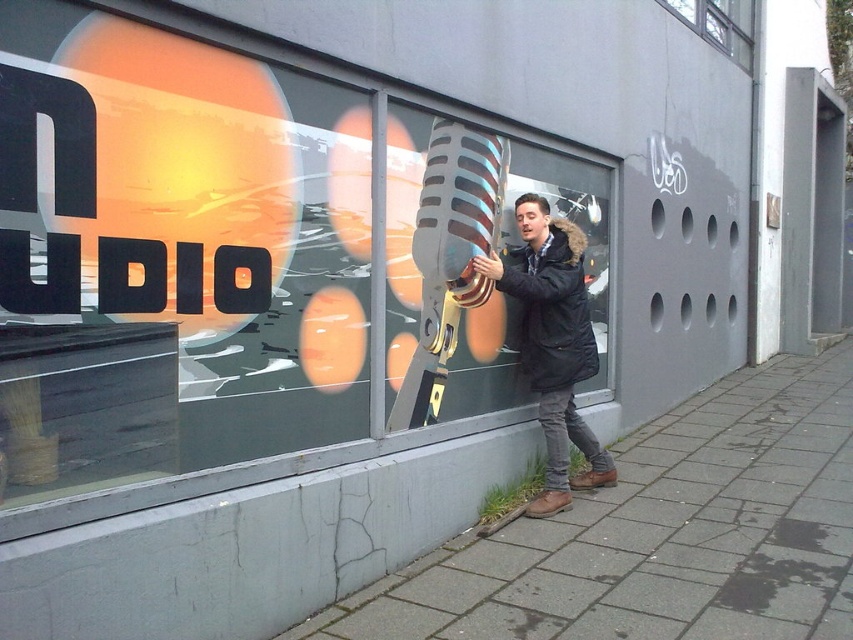
Looking at this image, which of these two, metallic glass microphone at center or gray concrete pavement at lower right, stands taller?

metallic glass microphone at center is taller.

What are the coordinates of `metallic glass microphone at center` in the screenshot? It's located at (210, 264).

Describe the element at coordinates (210, 264) in the screenshot. Image resolution: width=853 pixels, height=640 pixels. I see `metallic glass microphone at center` at that location.

Where is `metallic glass microphone at center`? The width and height of the screenshot is (853, 640). metallic glass microphone at center is located at coordinates (210, 264).

Consider the image. Who is positioned more to the left, gray concrete pavement at lower right or clear glass window at upper center?

Positioned to the left is gray concrete pavement at lower right.

Does point (734, 605) come closer to viewer compared to point (724, 44)?

Yes.

Locate an element on the screen. This screenshot has width=853, height=640. gray concrete pavement at lower right is located at coordinates (660, 532).

Based on the photo, measure the distance between black matte jacket at center and clear glass window at upper center.

They are 3.80 meters apart.

Which is more to the right, black matte jacket at center or clear glass window at upper center?

clear glass window at upper center

Locate an element on the screen. This screenshot has height=640, width=853. black matte jacket at center is located at coordinates (553, 344).